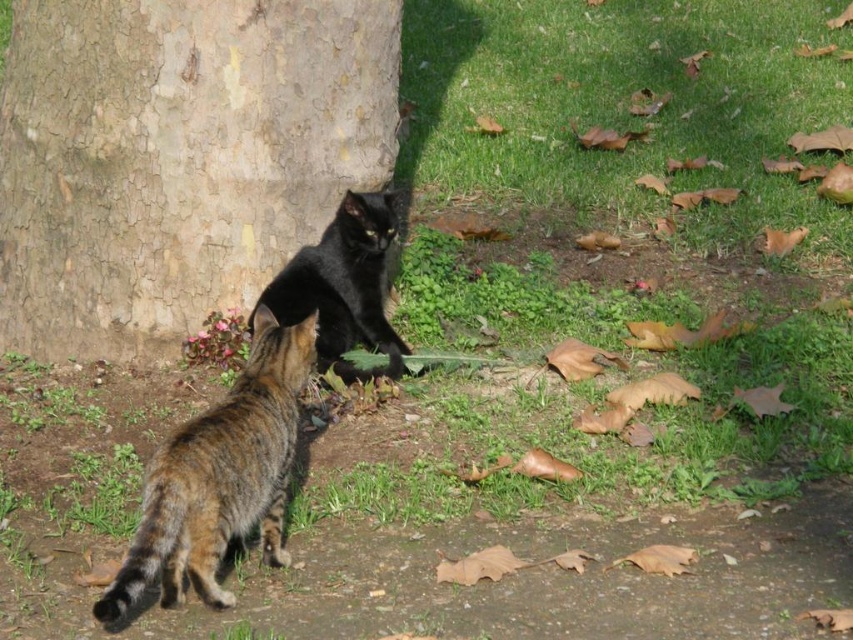
You are a photographer trying to capture a photo of the tabby fur cat at lower left and the smooth bark tree trunk at center. If you want to ensure both subjects are in focus, and your camera can only focus on objects within a 3.5 feet range, will you be able to achieve this?

The smooth bark tree trunk at center is 4.18 feet from the tabby fur cat at lower left. Since the distance between them exceeds the camera focus range of 3.5 feet, you wonlt be able to have both in focus simultaneously.

You are a photographer trying to capture both the smooth bark tree trunk at center and the shiny black cat at center in a single shot. Based on their positions, which object should you focus on first to ensure both are in frame?

The smooth bark tree trunk at center is positioned over the shiny black cat at center, so you should focus on the shiny black cat at center first to ensure both are in frame.